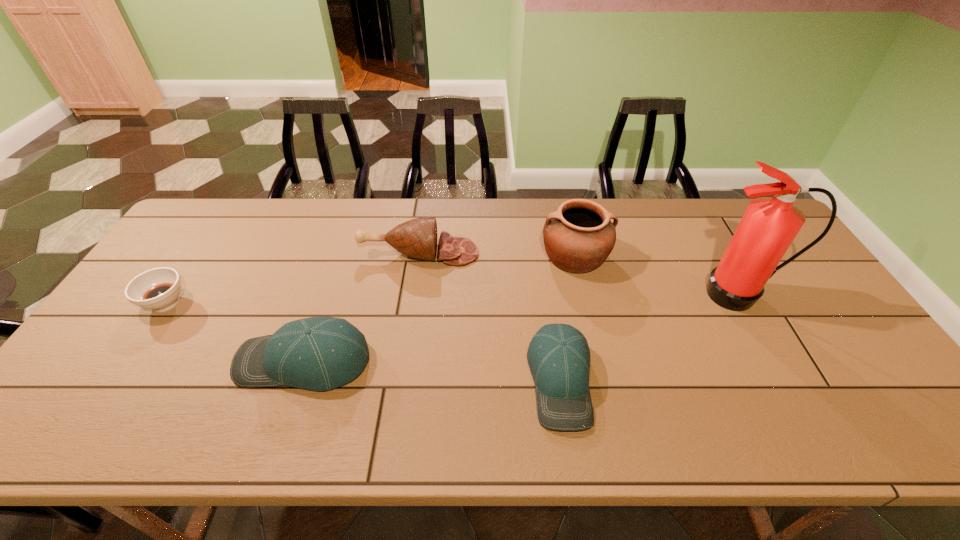
At what (x,y) coordinates should I click in order to perform the action: click on free point at the near edge. Please return your answer as a coordinate pair (x, y). Looking at the image, I should click on (340, 402).

I want to click on vacant space at the right edge of the desktop, so click(814, 281).

In the image, there is a desktop. Identify the location of vacant space at the far left corner. (209, 229).

This screenshot has width=960, height=540. I want to click on free space between the soup bowl and the tallest object, so [x=453, y=299].

I want to click on vacant space that's between the pottery and the shortest object, so click(371, 279).

I want to click on vacant space that is in between the tallest object and the left baseball cap, so click(x=521, y=328).

You are a GUI agent. You are given a task and a screenshot of the screen. Output one action in this format:
    pyautogui.click(x=<x>, y=<y>)
    Task: Click on the unoccupied area between the shorter baseball cap and the pottery
    The width and height of the screenshot is (960, 540).
    Given the screenshot: What is the action you would take?
    pyautogui.click(x=567, y=318)

Where is `free spot between the taller baseball cap and the tallest object`? The height and width of the screenshot is (540, 960). free spot between the taller baseball cap and the tallest object is located at coordinates (521, 328).

The width and height of the screenshot is (960, 540). Find the location of `free space between the soup bowl and the taller baseball cap`. free space between the soup bowl and the taller baseball cap is located at coordinates (235, 332).

Image resolution: width=960 pixels, height=540 pixels. Find the location of `free space between the second shortest object and the pottery`. free space between the second shortest object and the pottery is located at coordinates (567, 318).